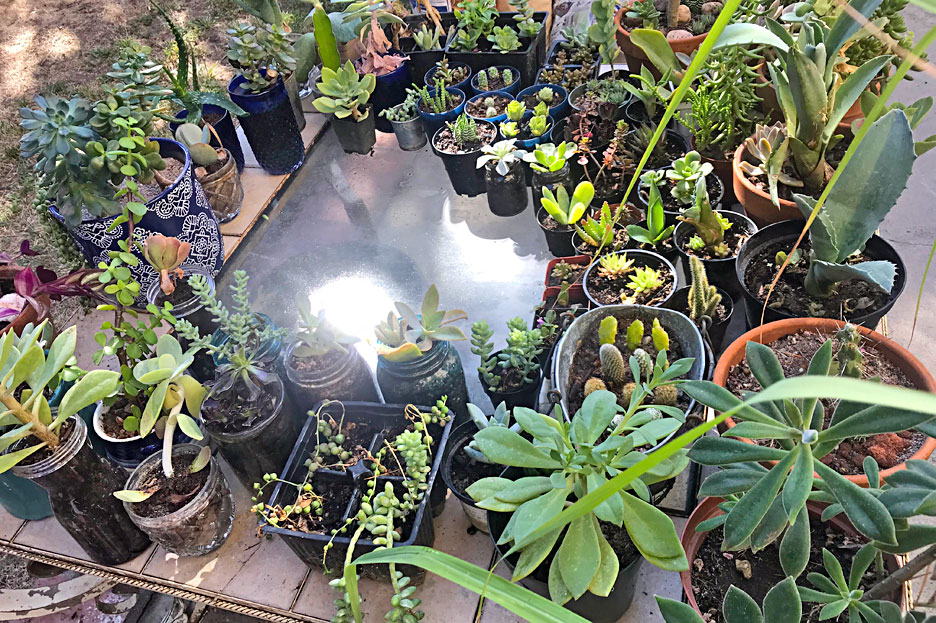
Identify the location of tiles. (254, 578), (442, 601), (49, 538), (250, 199), (312, 126), (652, 576).